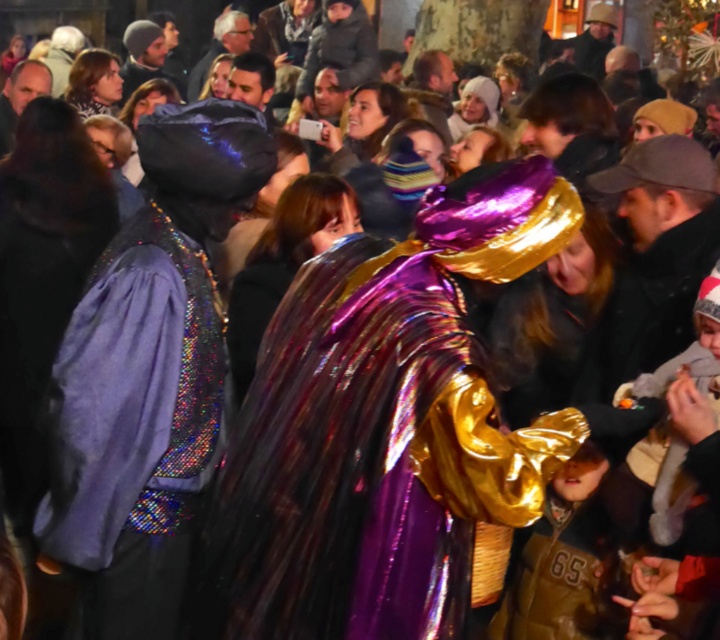
Does point (351, 451) come behind point (117, 612)?

No, (351, 451) is closer to viewer.

Does metallic purple cape at center have a greater height compared to shiny purple cape at center?

In fact, metallic purple cape at center may be shorter than shiny purple cape at center.

Is point (333, 596) closer to camera compared to point (202, 280)?

Yes, it is.

I want to click on metallic purple cape at center, so click(x=387, y=426).